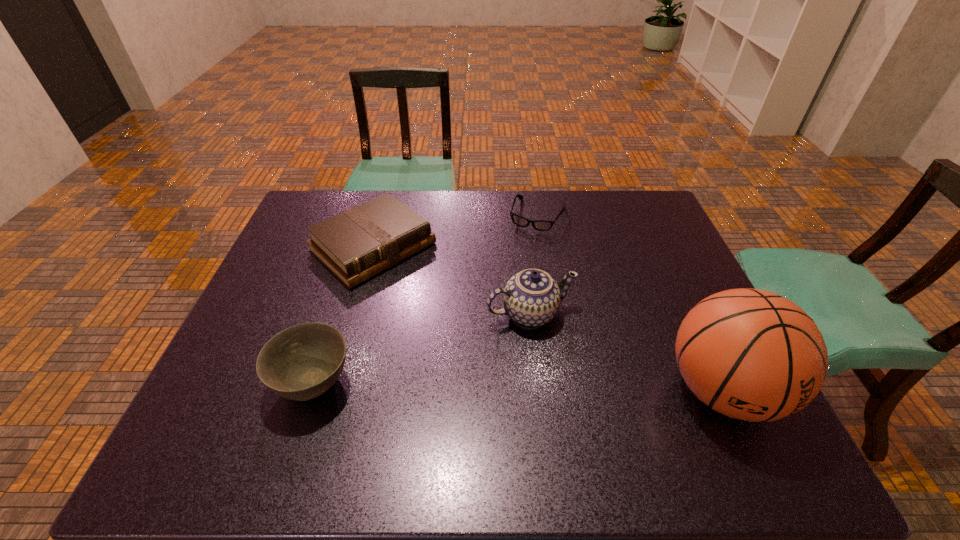
I want to click on blank space at the right edge of the desktop, so click(644, 238).

Where is `empty space that is in between the tallest object and the spectacles`? This screenshot has width=960, height=540. empty space that is in between the tallest object and the spectacles is located at coordinates (630, 303).

Locate an element on the screen. The image size is (960, 540). vacant point located between the spectacles and the Bible is located at coordinates (455, 231).

You are a GUI agent. You are given a task and a screenshot of the screen. Output one action in this format:
    pyautogui.click(x=<x>, y=<y>)
    Task: Click on the unoccupied position between the shortest object and the third farthest object
    Image resolution: width=960 pixels, height=540 pixels.
    Given the screenshot: What is the action you would take?
    pyautogui.click(x=534, y=265)

You are a GUI agent. You are given a task and a screenshot of the screen. Output one action in this format:
    pyautogui.click(x=<x>, y=<y>)
    Task: Click on the vacant space in between the bowl and the shortest object
    The height and width of the screenshot is (540, 960).
    Given the screenshot: What is the action you would take?
    pyautogui.click(x=426, y=299)

At what (x,y) coordinates should I click in order to perform the action: click on empty space between the Bible and the spectacles. Please return your answer as a coordinate pair (x, y). The image size is (960, 540). Looking at the image, I should click on click(455, 231).

You are a GUI agent. You are given a task and a screenshot of the screen. Output one action in this format:
    pyautogui.click(x=<x>, y=<y>)
    Task: Click on the free space between the tallest object and the chinaware
    Image resolution: width=960 pixels, height=540 pixels.
    Given the screenshot: What is the action you would take?
    pyautogui.click(x=627, y=352)

The width and height of the screenshot is (960, 540). Identify the location of free spot between the fourth tallest object and the third tallest object. (344, 315).

What are the coordinates of `free spot between the chinaware and the bowl` in the screenshot? It's located at (422, 348).

This screenshot has height=540, width=960. In order to click on vacant point located between the third farthest object and the shortest object in this screenshot , I will do `click(534, 265)`.